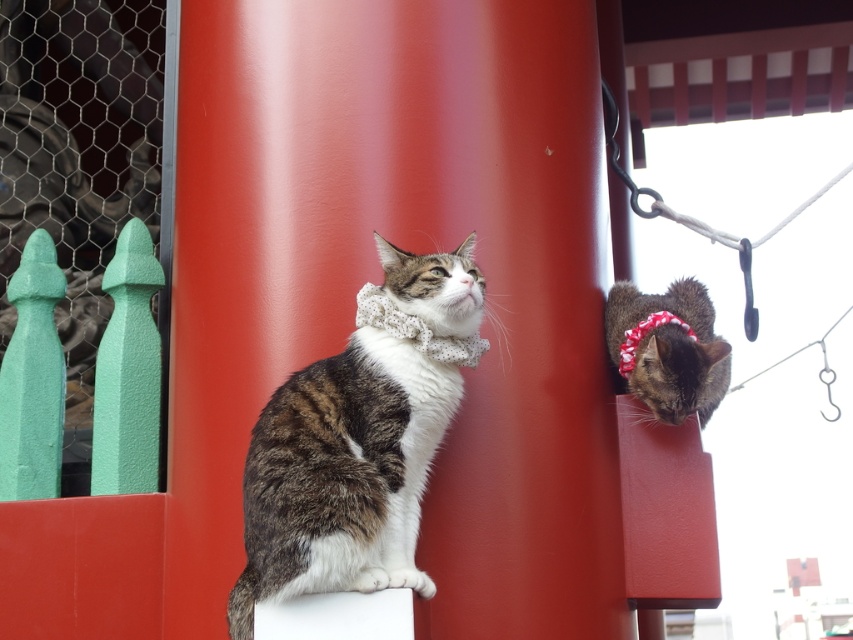
Which is behind, point (619, 570) or point (695, 300)?

Positioned behind is point (695, 300).

Is smooth red pillar at center thinner than tabby fur cat at upper right?

No, smooth red pillar at center is not thinner than tabby fur cat at upper right.

Does point (471, 468) come farther from viewer compared to point (688, 349)?

No, it is in front of (688, 349).

The width and height of the screenshot is (853, 640). I want to click on smooth red pillar at center, so click(x=379, y=276).

Can you confirm if smooth red pillar at center is positioned to the left of tabby fur cat at center?

Incorrect, smooth red pillar at center is not on the left side of tabby fur cat at center.

Does smooth red pillar at center lie behind tabby fur cat at center?

Yes, it is behind tabby fur cat at center.

Describe the element at coordinates (379, 276) in the screenshot. I see `smooth red pillar at center` at that location.

Image resolution: width=853 pixels, height=640 pixels. I want to click on smooth red pillar at center, so click(379, 276).

How distant is tabby fur cat at center from tabby fur cat at upper right?

A distance of 2.60 meters exists between tabby fur cat at center and tabby fur cat at upper right.

Is tabby fur cat at center above tabby fur cat at upper right?

No, tabby fur cat at center is not above tabby fur cat at upper right.

Which is behind, point (370, 420) or point (621, 333)?

Point (621, 333)

You are a GUI agent. You are given a task and a screenshot of the screen. Output one action in this format:
    pyautogui.click(x=<x>, y=<y>)
    Task: Click on the tabby fur cat at center
    This screenshot has width=853, height=640.
    Given the screenshot: What is the action you would take?
    pyautogui.click(x=341, y=474)